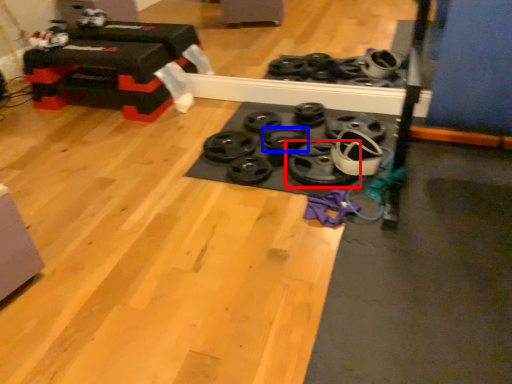
Question: Which object is further to the camera taking this photo, wheel (highlighted by a red box) or wheel (highlighted by a blue box)?

Choices:
 (A) wheel
 (B) wheel

Answer: (B)